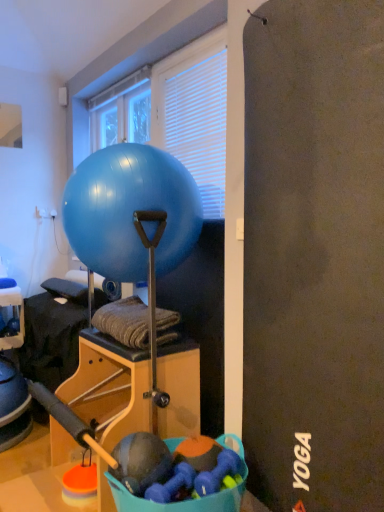
Question: From the image's perspective, would you say white blinds at upper center is shown under transparent glass window at upper center?

Choices:
 (A) yes
 (B) no

Answer: (A)

Question: Can you confirm if white blinds at upper center is thinner than transparent glass window at upper center?

Choices:
 (A) no
 (B) yes

Answer: (B)

Question: Could transparent glass window at upper center be considered to be inside white blinds at upper center?

Choices:
 (A) yes
 (B) no

Answer: (B)

Question: Can you confirm if white blinds at upper center is smaller than transparent glass window at upper center?

Choices:
 (A) no
 (B) yes

Answer: (A)

Question: Is white blinds at upper center closer to the viewer compared to transparent glass window at upper center?

Choices:
 (A) yes
 (B) no

Answer: (A)

Question: From the image's perspective, is white blinds at upper center located above transparent glass window at upper center?

Choices:
 (A) no
 (B) yes

Answer: (A)

Question: Considering the relative sizes of blue glossy exercise ball at center and white blinds at upper center in the image provided, is blue glossy exercise ball at center bigger than white blinds at upper center?

Choices:
 (A) no
 (B) yes

Answer: (B)

Question: Considering the relative sizes of blue glossy exercise ball at center and white blinds at upper center in the image provided, is blue glossy exercise ball at center taller than white blinds at upper center?

Choices:
 (A) no
 (B) yes

Answer: (A)

Question: Would you say blue glossy exercise ball at center contains white blinds at upper center?

Choices:
 (A) yes
 (B) no

Answer: (B)

Question: Does blue glossy exercise ball at center come in front of white blinds at upper center?

Choices:
 (A) yes
 (B) no

Answer: (A)

Question: Can you confirm if blue glossy exercise ball at center is wider than white blinds at upper center?

Choices:
 (A) yes
 (B) no

Answer: (A)

Question: Is blue glossy exercise ball at center far from white blinds at upper center?

Choices:
 (A) yes
 (B) no

Answer: (B)

Question: Is white blinds at upper center next to blue glossy exercise ball at center?

Choices:
 (A) yes
 (B) no

Answer: (B)